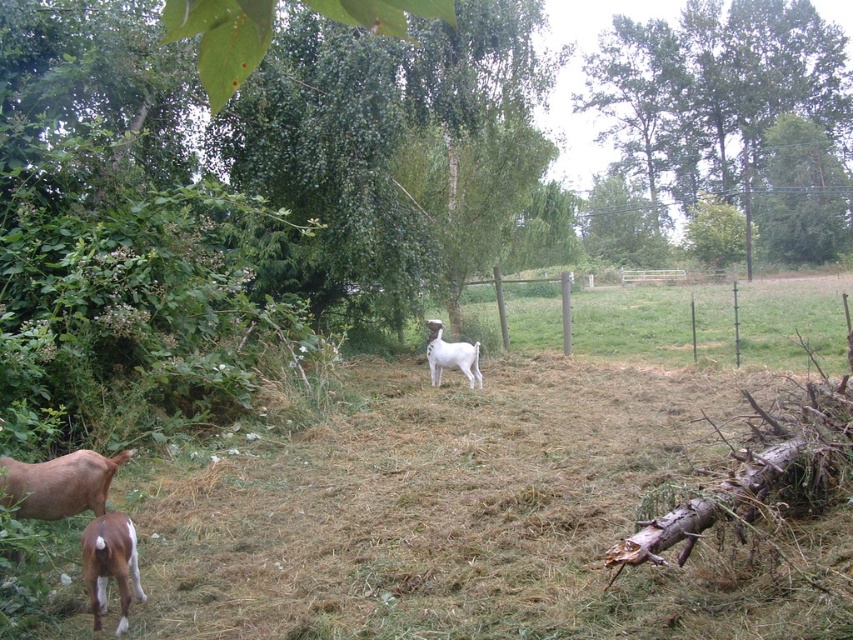
Question: Is brown glossy goat at lower left above white woolen goat at center?

Choices:
 (A) no
 (B) yes

Answer: (A)

Question: Which point is closer to the camera?

Choices:
 (A) brown glossy goat at lower left
 (B) green leafy tree at upper center

Answer: (A)

Question: Which of the following is the closest to the observer?

Choices:
 (A) brown glossy goat at lower left
 (B) green leafy tree at upper center
 (C) white woolen goat at center

Answer: (A)

Question: Is green leafy tree at upper center wider than white woolen goat at center?

Choices:
 (A) no
 (B) yes

Answer: (B)

Question: Does green leafy tree at upper center appear on the right side of white woolen goat at center?

Choices:
 (A) yes
 (B) no

Answer: (A)

Question: Among these objects, which one is farthest from the camera?

Choices:
 (A) brown glossy goat at lower left
 (B) white woolen goat at center

Answer: (B)